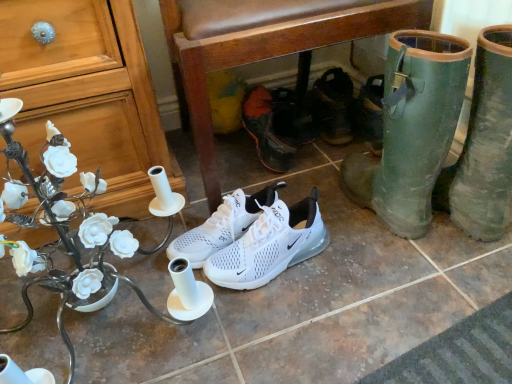
This screenshot has height=384, width=512. I want to click on free space to the left of white mesh sneakers at center, the 2th footwear viewed from the front, so click(x=167, y=280).